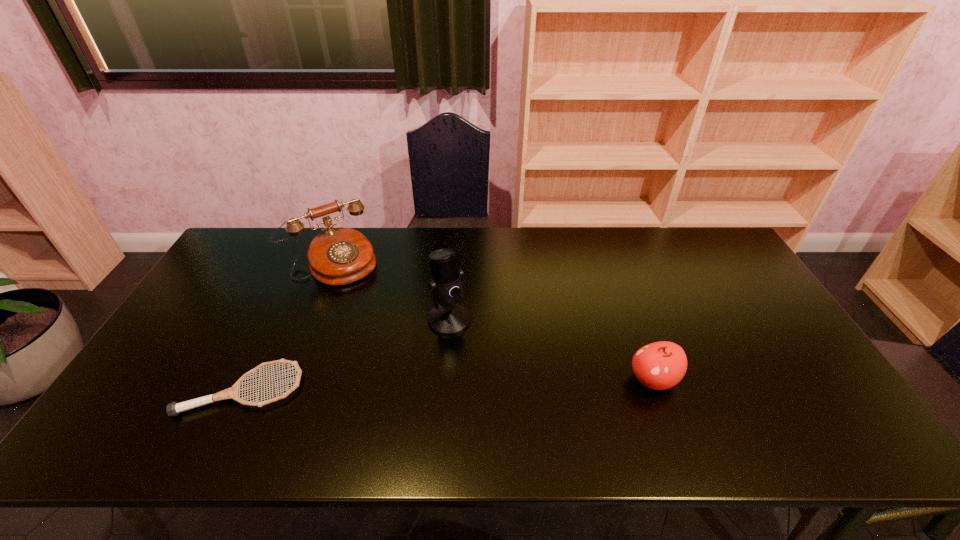
Locate an element on the screen. vacant area between the apple and the tennis racket is located at coordinates (447, 384).

Where is `vacant area that lies between the telephone and the rightmost object`? vacant area that lies between the telephone and the rightmost object is located at coordinates (492, 321).

Where is `blank region between the second shortest object and the farthest object`? The image size is (960, 540). blank region between the second shortest object and the farthest object is located at coordinates (492, 321).

You are a GUI agent. You are given a task and a screenshot of the screen. Output one action in this format:
    pyautogui.click(x=<x>, y=<y>)
    Task: Click on the vacant area that lies between the third tallest object and the microphone
    The image size is (960, 540).
    Given the screenshot: What is the action you would take?
    pyautogui.click(x=551, y=349)

At what (x,y) coordinates should I click in order to perform the action: click on vacant area between the farthest object and the rightmost object. Please return your answer as a coordinate pair (x, y). The height and width of the screenshot is (540, 960). Looking at the image, I should click on (492, 321).

Find the location of a particular element. Image resolution: width=960 pixels, height=540 pixels. free point between the telephone and the shortest object is located at coordinates (287, 326).

Locate which object ranks third in proximity to the third shortest object. Please provide its 2D coordinates. Your answer should be formatted as a tuple, i.e. [(x, y)], where the tuple contains the x and y coordinates of a point satisfying the conditions above.

[(661, 365)]

Select which object is the second closest to the tallest object. Please provide its 2D coordinates. Your answer should be formatted as a tuple, i.e. [(x, y)], where the tuple contains the x and y coordinates of a point satisfying the conditions above.

[(173, 409)]

At what (x,y) coordinates should I click in order to perform the action: click on free space that satisfies the following two spatial constraints: 1. on the back side of the apple; 2. on the left side of the tennis racket. Please return your answer as a coordinate pair (x, y). Looking at the image, I should click on (248, 380).

Where is `vacant space that satisfies the following two spatial constraints: 1. on the front side of the second tallest object; 2. on the left side of the tallest object`? The height and width of the screenshot is (540, 960). vacant space that satisfies the following two spatial constraints: 1. on the front side of the second tallest object; 2. on the left side of the tallest object is located at coordinates (309, 320).